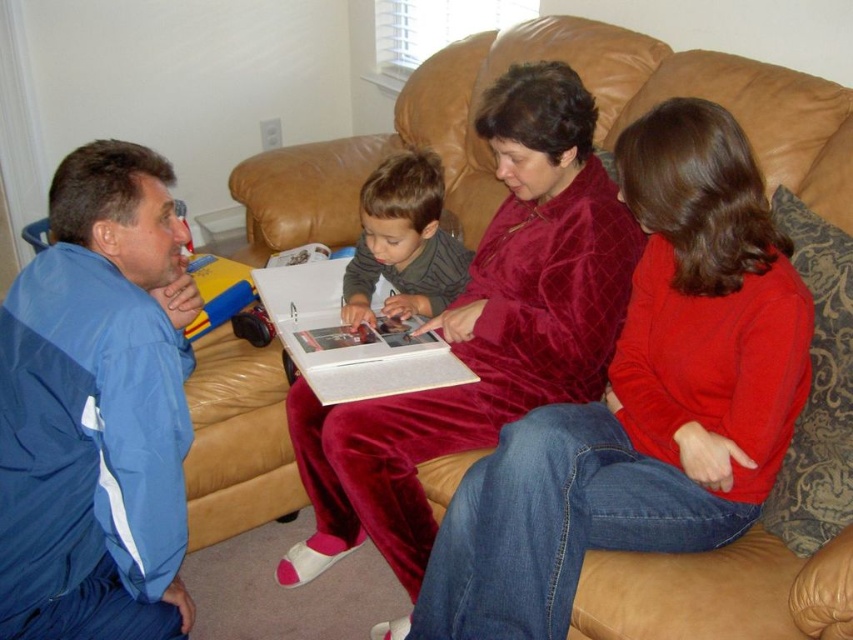
You are standing in the living room and want to reach the point at coordinates (320, 556). Is there any object or person blocking your path to that point?

The point at coordinates (320, 556) is 6.19 feet away from the viewer, so there is no object or person blocking the path to that point.

You are a delivery robot with a 20 inch wide package. You need to navigate through the space between the blue fabric jacket at lower left and the velvet maroon pajamas at center to reach the delivery point. Can you fit through the space?

The distance between the blue fabric jacket at lower left and the velvet maroon pajamas at center is 21.19 inches. Since the package is 20 inches wide, it can fit through the space as there is enough clearance.